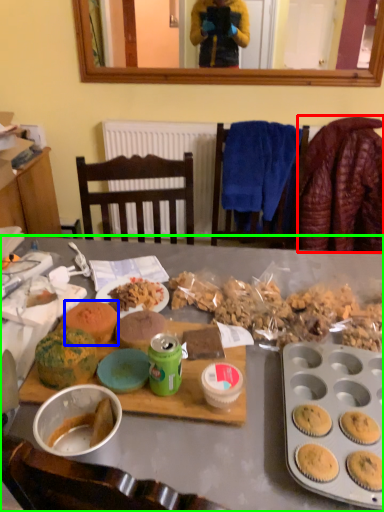
Question: Considering the real-world distances, which object is closest to blanket (highlighted by a red box)? snack (highlighted by a blue box) or desk (highlighted by a green box).

Choices:
 (A) snack
 (B) desk

Answer: (B)